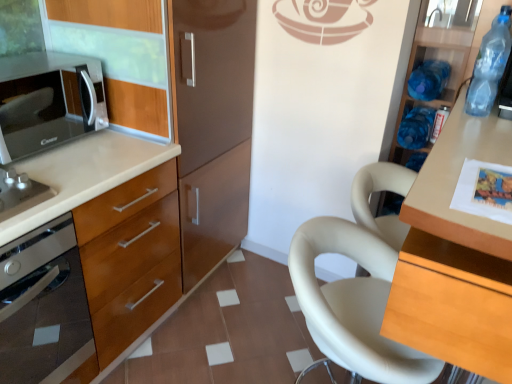
Question: Does blue plastic bottle at upper right, the 2th bottle from the front, turn towards satin silver oven at left?

Choices:
 (A) yes
 (B) no

Answer: (B)

Question: From a real-world perspective, is blue plastic bottle at upper right, the 2th bottle from the front, located higher than satin silver oven at left?

Choices:
 (A) no
 (B) yes

Answer: (B)

Question: Is blue plastic bottle at upper right, the 2th bottle from the front, to the right of satin silver oven at left from the viewer's perspective?

Choices:
 (A) yes
 (B) no

Answer: (A)

Question: From a real-world perspective, is blue plastic bottle at upper right, which ranks as the second bottle in back-to-front order, located beneath satin silver oven at left?

Choices:
 (A) yes
 (B) no

Answer: (B)

Question: Is blue plastic bottle at upper right, which ranks as the second bottle in back-to-front order, facing away from satin silver oven at left?

Choices:
 (A) no
 (B) yes

Answer: (A)

Question: Do you think blue plastic bottle at upper right, which ranks as the second bottle in back-to-front order, is within light wood table at right, marked as the 1th cabinetry in a right-to-left arrangement, or outside of it?

Choices:
 (A) outside
 (B) inside

Answer: (A)

Question: Considering the positions of blue plastic bottle at upper right, which ranks as the second bottle in back-to-front order, and light wood table at right, marked as the 1th cabinetry in a right-to-left arrangement, in the image, is blue plastic bottle at upper right, which ranks as the second bottle in back-to-front order, wider or thinner than light wood table at right, marked as the 1th cabinetry in a right-to-left arrangement,?

Choices:
 (A) thin
 (B) wide

Answer: (A)

Question: From a real-world perspective, is blue plastic bottle at upper right, the 2th bottle from the front, above or below light wood table at right, placed as the 2th cabinetry when sorted from left to right?

Choices:
 (A) below
 (B) above

Answer: (B)

Question: Relative to light wood table at right, marked as the 1th cabinetry in a right-to-left arrangement, is blue plastic bottle at upper right, which ranks as the second bottle in back-to-front order, in front or behind?

Choices:
 (A) front
 (B) behind

Answer: (B)

Question: From their relative heights in the image, would you say blue plastic bottle at upper right, which ranks as the second bottle in back-to-front order, is taller or shorter than satin silver oven at left?

Choices:
 (A) tall
 (B) short

Answer: (B)

Question: Is point (443, 79) closer or farther from the camera than point (65, 319)?

Choices:
 (A) closer
 (B) farther

Answer: (B)

Question: From a real-world perspective, is blue plastic bottle at upper right, which ranks as the second bottle in back-to-front order, physically located above or below satin silver oven at left?

Choices:
 (A) above
 (B) below

Answer: (A)

Question: Based on their positions, is blue plastic bottle at upper right, the 2th bottle from the front, located to the left or right of satin silver oven at left?

Choices:
 (A) right
 (B) left

Answer: (A)

Question: In terms of size, does satin silver oven at left appear bigger or smaller than blue plastic bottle at upper right, which ranks as the second bottle in back-to-front order?

Choices:
 (A) small
 (B) big

Answer: (B)

Question: Is satin silver oven at left situated inside blue plastic bottle at upper right, the 2th bottle from the front, or outside?

Choices:
 (A) inside
 (B) outside

Answer: (B)